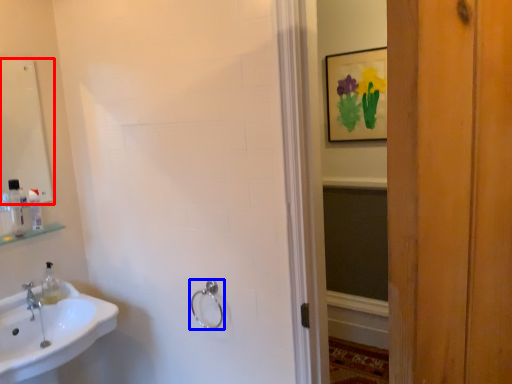
Question: Which object appears farthest to the camera in this image, mirror (highlighted by a red box) or towel rack (highlighted by a blue box)?

Choices:
 (A) mirror
 (B) towel rack

Answer: (A)